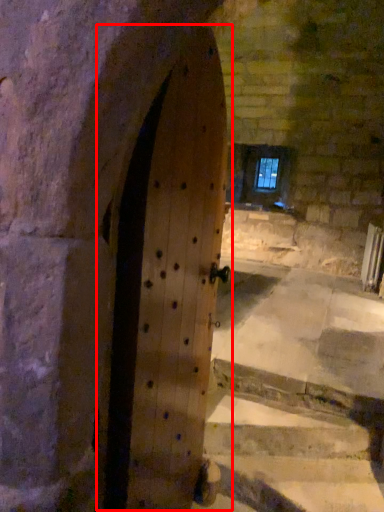
Question: From the image's perspective, where is door (annotated by the red box) located in relation to window in the image?

Choices:
 (A) below
 (B) above

Answer: (A)